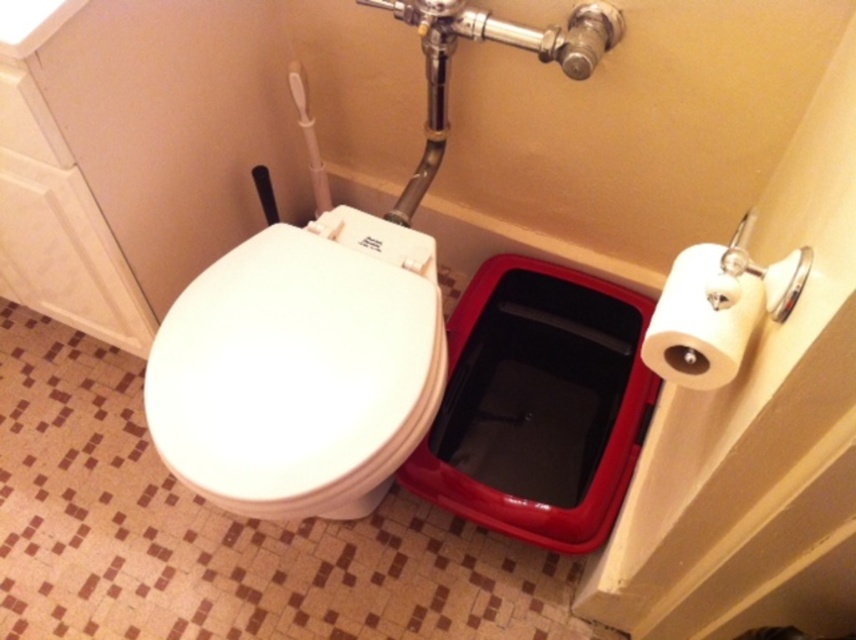
You are a home inspector assessing bathroom fixtures. You see the white glossy toilet seat at center and the white matte toilet paper at right. Which fixture is positioned closer to the right side of the bathroom?

The white matte toilet paper at right is positioned closer to the right side of the bathroom because it is to the right of the white glossy toilet seat at center.

You are a home inspector assessing bathroom fixtures. You need to determine if the white glossy toilet seat at center is positioned higher than the white matte toilet paper at right. Based on the scene description, what can you conclude?

The white glossy toilet seat at center is much taller than the white matte toilet paper at right, so the toilet seat is positioned higher than the toilet paper.